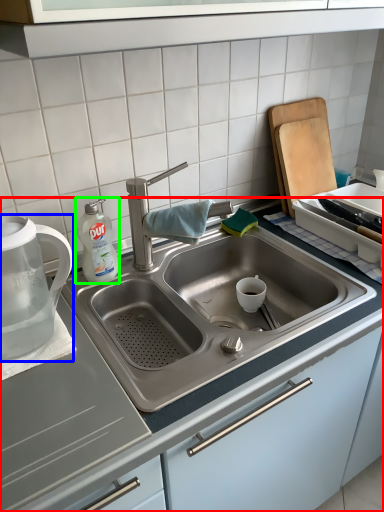
Question: Based on their relative distances, which object is farther from countertop (highlighted by a red box)? Choose from tea pot (highlighted by a blue box) and cleaning product (highlighted by a green box).

Choices:
 (A) tea pot
 (B) cleaning product

Answer: (B)